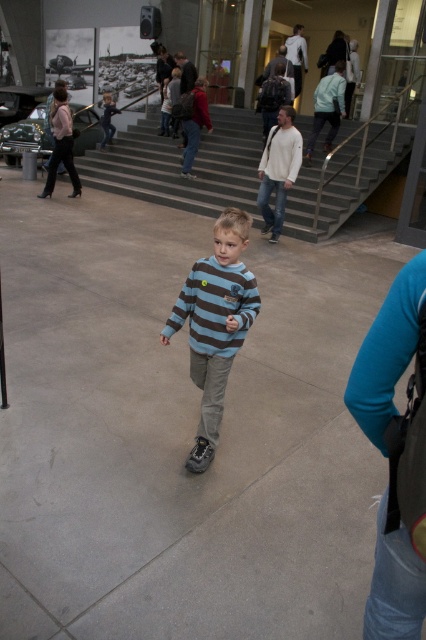
Can you confirm if gray concrete pavement at center is positioned above striped cotton shirt at center?

Incorrect, gray concrete pavement at center is not positioned above striped cotton shirt at center.

From the picture: Is gray concrete pavement at center shorter than striped cotton shirt at center?

Indeed, gray concrete pavement at center has a lesser height compared to striped cotton shirt at center.

Is point (37, 321) in front of point (256, 284)?

No, it is not.

Image resolution: width=426 pixels, height=640 pixels. Identify the location of gray concrete pavement at center. (178, 433).

From the picture: Does gray concrete pavement at center lie in front of matte red sweater at center?

Yes, it is in front of matte red sweater at center.

Is point (204, 554) closer to viewer compared to point (195, 104)?

Yes, point (204, 554) is in front of point (195, 104).

Does point (164, 397) come closer to viewer compared to point (189, 141)?

Yes, point (164, 397) is in front of point (189, 141).

Locate an element on the screen. gray concrete pavement at center is located at coordinates (178, 433).

Between gray concrete stairs at center and striped cotton shirt at center, which one appears on the left side from the viewer's perspective?

Positioned to the left is striped cotton shirt at center.

Between gray concrete stairs at center and striped cotton shirt at center, which one is positioned higher?

gray concrete stairs at center is above.

Locate an element on the screen. This screenshot has width=426, height=640. gray concrete stairs at center is located at coordinates (180, 166).